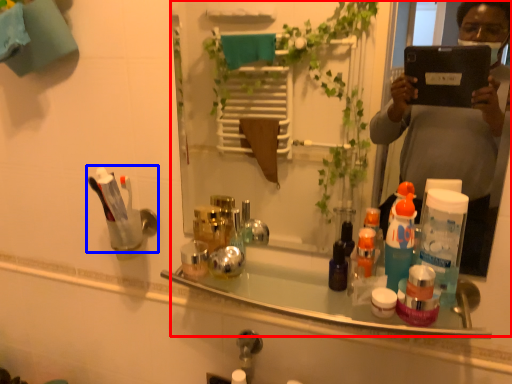
Question: Which object appears farthest to the camera in this image, mirror (highlighted by a red box) or toiletry (highlighted by a blue box)?

Choices:
 (A) mirror
 (B) toiletry

Answer: (B)